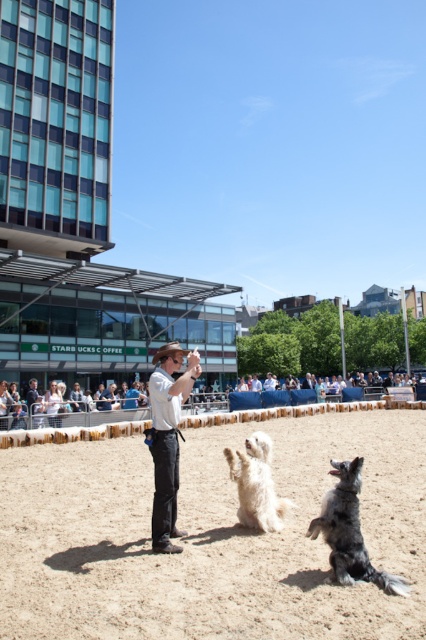
Question: In this image, where is silver metallic dog at center located relative to white fluffy dog at center?

Choices:
 (A) above
 (B) below

Answer: (B)

Question: Considering the real-world distances, which object is farthest from the brown sandy dirt at center?

Choices:
 (A) white cotton shirt at center
 (B) brown leather cowboy hat at center

Answer: (A)

Question: Which object appears farthest from the camera in this image?

Choices:
 (A) brown leather cowboy hat at center
 (B) brown sandy dirt at center
 (C) white cotton shirt at center
 (D) white fluffy dog at center

Answer: (D)

Question: Is silver metallic dog at center in front of brown leather cowboy hat at center?

Choices:
 (A) yes
 (B) no

Answer: (A)

Question: Does brown sandy dirt at center appear over white fluffy dog at center?

Choices:
 (A) yes
 (B) no

Answer: (B)

Question: Which object is positioned farthest from the brown leather cowboy hat at center?

Choices:
 (A) white cotton shirt at center
 (B) white fluffy dog at center
 (C) silver metallic dog at center

Answer: (C)